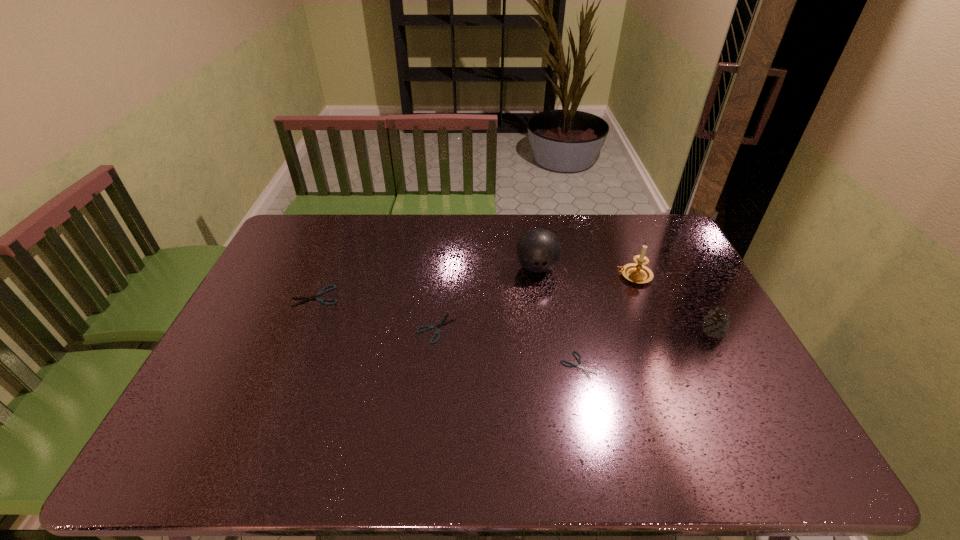
Find the location of `pinecone positioned at the right edge`. pinecone positioned at the right edge is located at coordinates (715, 324).

In the image, there is a desktop. Where is `vacant area at the far edge`? The height and width of the screenshot is (540, 960). vacant area at the far edge is located at coordinates (406, 217).

In the image, there is a desktop. Find the location of `vacant space at the near edge`. vacant space at the near edge is located at coordinates (557, 394).

Find the location of a particular element. Image resolution: width=960 pixels, height=540 pixels. free region at the left edge is located at coordinates (282, 300).

The height and width of the screenshot is (540, 960). In order to click on free space at the right edge in this screenshot , I will do `click(680, 329)`.

Where is `vacant space at the far left corner of the desktop`? vacant space at the far left corner of the desktop is located at coordinates (291, 238).

The height and width of the screenshot is (540, 960). Identify the location of empty space that is in between the bowling ball and the leftmost shears. (426, 282).

Locate an element on the screen. The width and height of the screenshot is (960, 540). vacant area that lies between the fifth object from left to right and the pinecone is located at coordinates (673, 304).

You are a GUI agent. You are given a task and a screenshot of the screen. Output one action in this format:
    pyautogui.click(x=<x>, y=<y>)
    Task: Click on the empty location between the shortest object and the second object from right to left
    
    Given the screenshot: What is the action you would take?
    pyautogui.click(x=606, y=321)

Locate an element on the screen. unoccupied area between the rightmost object and the third shortest object is located at coordinates (514, 314).